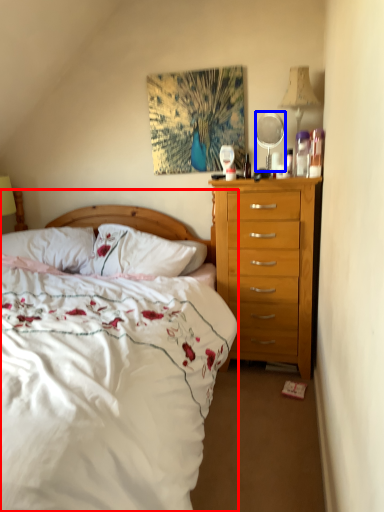
Question: Which of the following is the farthest to the observer, bed (highlighted by a red box) or mirror (highlighted by a blue box)?

Choices:
 (A) bed
 (B) mirror

Answer: (B)